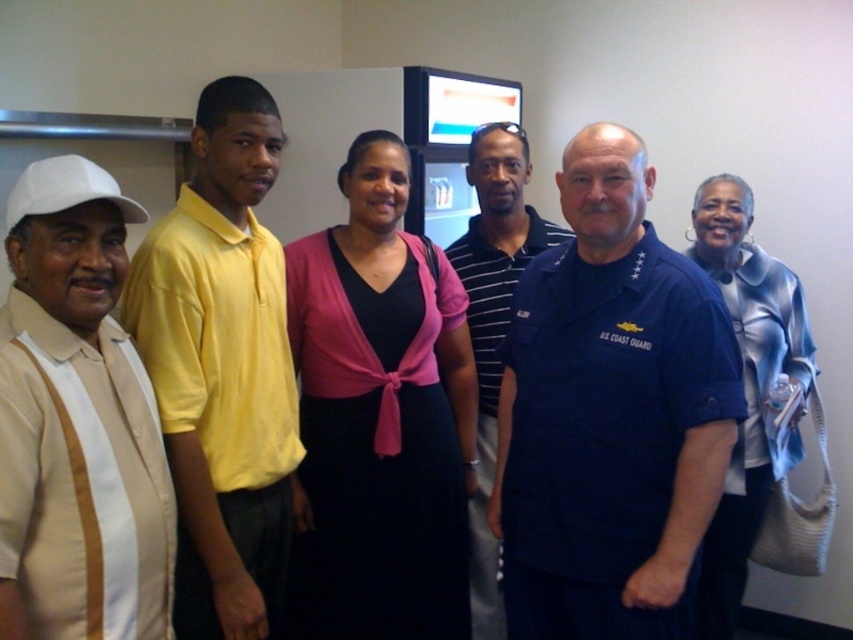
Is black satin dress at center shorter than beige striped shirt at left?

No.

Between point (381, 268) and point (57, 288), which one is positioned behind?

The point (381, 268) is behind.

Locate an element on the screen. This screenshot has height=640, width=853. black satin dress at center is located at coordinates (379, 419).

Is beige striped shirt at left further to camera compared to blue striped polo shirt at center?

No, beige striped shirt at left is closer to the viewer.

This screenshot has height=640, width=853. Describe the element at coordinates (77, 420) in the screenshot. I see `beige striped shirt at left` at that location.

Locate an element on the screen. This screenshot has width=853, height=640. beige striped shirt at left is located at coordinates (77, 420).

Can you confirm if navy blue uniform at center is bigger than black satin dress at center?

Yes, navy blue uniform at center is bigger than black satin dress at center.

Locate an element on the screen. The image size is (853, 640). navy blue uniform at center is located at coordinates (610, 413).